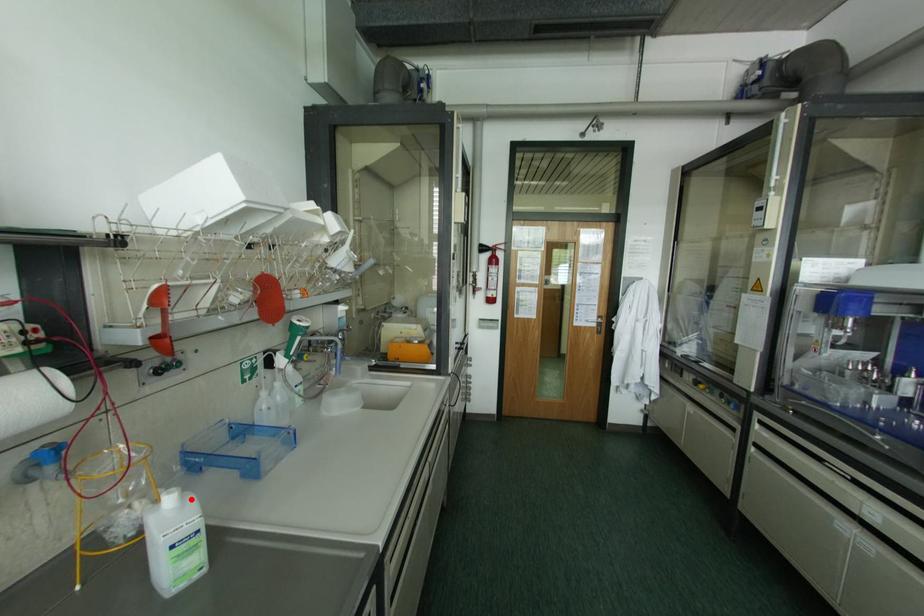
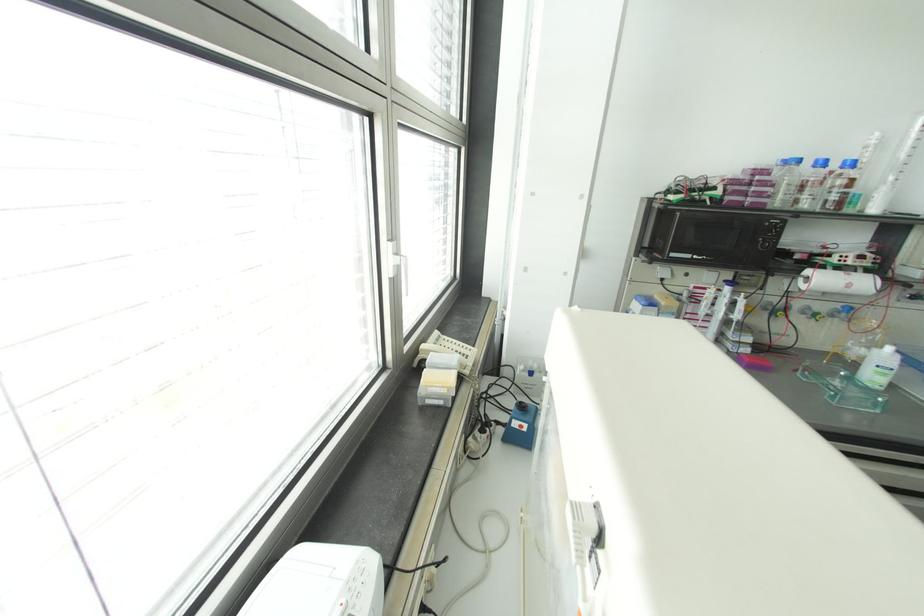
Find the pixel in the second image that matches the highlighted location in the first image.

(898, 355)